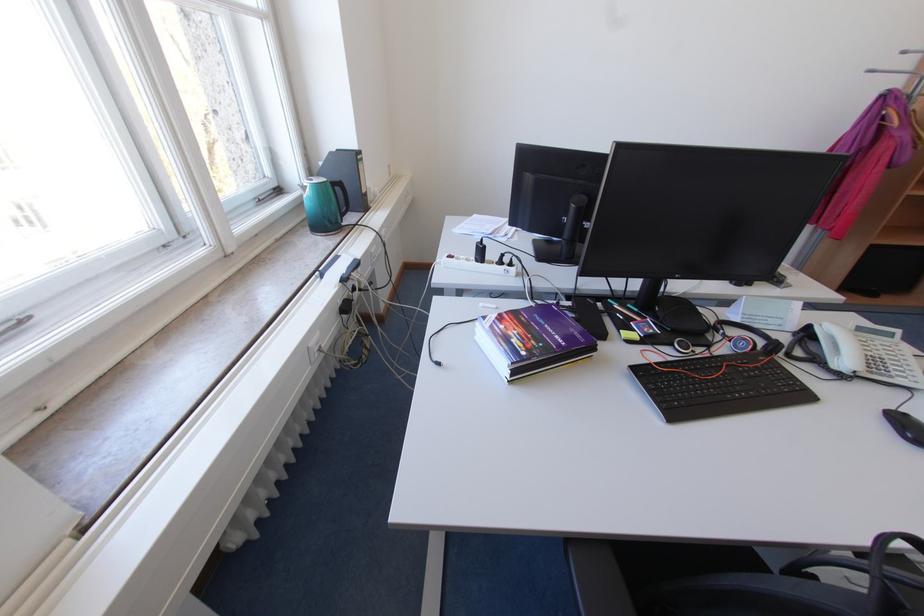
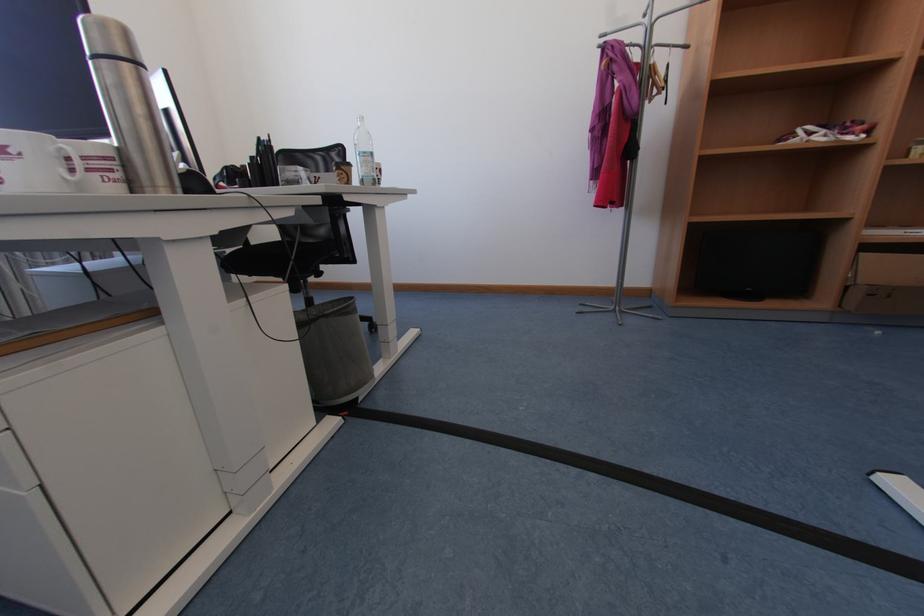
Question: The images are taken continuously from a first-person perspective. In which direction are you moving?

Choices:
 (A) Left
 (B) Right
 (C) Forward
 (D) Backward

Answer: (B)